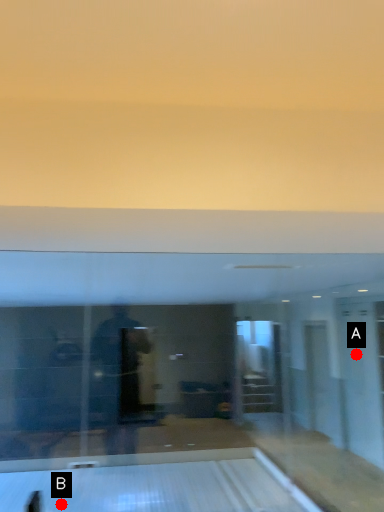
Question: Two points are circled on the image, labeled by A and B beside each circle. Which of the following is the farthest from the observer?

Choices:
 (A) A is further
 (B) B is further

Answer: (A)